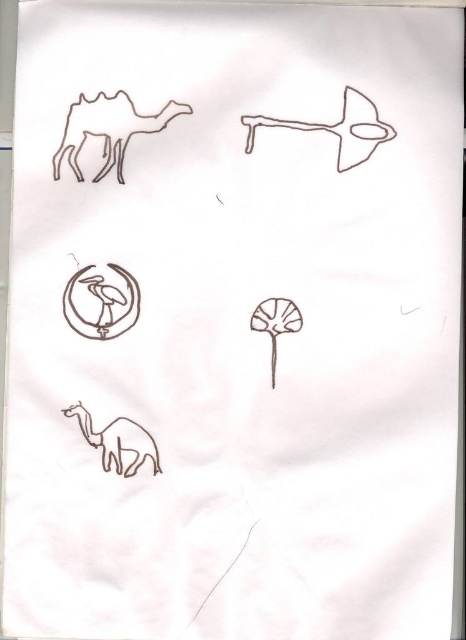
Looking at this image, you are looking at the paper with the drawings. There are two points marked on it, one at position point (336, 125) and the other at point (74, 413). Which point is closer to you?

Point (336, 125) is closer to the viewer than point (74, 413).

You are looking at the paper with the drawings. There are two points marked on the paper. The first point is at coordinates point (129, 132) and the second is at point (259, 125). From your perspective, which point appears closer to you?

Point (129, 132) is in front of point (259, 125), so it appears closer to you.

You are an art student analyzing the drawings on the paper. You notice the brown matte camel at upper left and the brown matte airplane at upper center. Which of these two drawings is larger in size?

The brown matte camel at upper left is bigger than the brown matte airplane at upper center, so the camel drawing is larger in size.